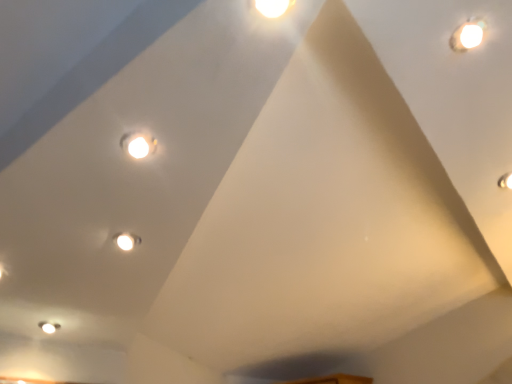
This screenshot has height=384, width=512. I want to click on matte white light at upper right, acting as the first light starting from the back, so click(x=505, y=181).

This screenshot has height=384, width=512. I want to click on white glossy droplight at upper right, so click(467, 36).

Does white glossy droplight at upper right appear on the right side of matte white light at upper center, placed as the second light when sorted from back to front?

Yes.

Is white glossy droplight at upper right directly adjacent to matte white light at upper center, which is counted as the second light, starting from the bottom?

They are not placed beside each other.

Is the depth of white glossy droplight at upper right less than that of matte white light at upper center, the 2th light when ordered from right to left?

Yes, it is in front of matte white light at upper center, the 2th light when ordered from right to left.

Can you confirm if white glossy droplight at upper right is wider than matte white light at upper center, which is the first light in left-to-right order?

Yes.

Is matte white light at upper center, the 2th light when ordered from right to left, facing away from matte white light at upper right, which is counted as the first light, starting from the bottom?

matte white light at upper center, the 2th light when ordered from right to left, is not turned away from matte white light at upper right, which is counted as the first light, starting from the bottom.

In the scene shown: Can you confirm if matte white light at upper center, placed as the second light when sorted from back to front, is positioned to the left of matte white light at upper right, placed as the second light when sorted from left to right?

Correct, you'll find matte white light at upper center, placed as the second light when sorted from back to front, to the left of matte white light at upper right, placed as the second light when sorted from left to right.

Considering the points (152, 145) and (502, 185), which point is in front, point (152, 145) or point (502, 185)?

The point (152, 145) is in front.

Is matte white light at upper center, the 2th light when ordered from right to left, wider or thinner than white glossy droplight at upper right?

In the image, matte white light at upper center, the 2th light when ordered from right to left, appears to be more narrow than white glossy droplight at upper right.

Looking at this image, choose the correct answer: Is matte white light at upper center, which is counted as the second light, starting from the bottom, inside white glossy droplight at upper right or outside it?

matte white light at upper center, which is counted as the second light, starting from the bottom, is outside white glossy droplight at upper right.

Image resolution: width=512 pixels, height=384 pixels. I want to click on the 1st light positioned below the white glossy droplight at upper right (from the image's perspective), so click(138, 144).

How far apart are matte white light at upper center, which is the first light in left-to-right order, and white glossy droplight at upper right?

They are 27.10 inches apart.

Is point (507, 179) positioned in front of point (480, 42)?

No, (507, 179) is further to viewer.

Does matte white light at upper right, the 2th light positioned from the top, have a greater width compared to white glossy droplight at upper right?

Indeed, matte white light at upper right, the 2th light positioned from the top, has a greater width compared to white glossy droplight at upper right.

Who is more distant, matte white light at upper right, acting as the first light starting from the back, or white glossy droplight at upper right?

Positioned behind is matte white light at upper right, acting as the first light starting from the back.

Does matte white light at upper right, placed as the second light when sorted from left to right, have a lesser height compared to matte white light at upper center, arranged as the 1th light when viewed from the top?

Incorrect, the height of matte white light at upper right, placed as the second light when sorted from left to right, does not fall short of that of matte white light at upper center, arranged as the 1th light when viewed from the top.

Could you tell me if matte white light at upper right, acting as the first light starting from the back, is facing matte white light at upper center, placed as the second light when sorted from back to front?

Yes, matte white light at upper right, acting as the first light starting from the back, is oriented towards matte white light at upper center, placed as the second light when sorted from back to front.

Considering the relative sizes of matte white light at upper right, the 2th light positioned from the top, and matte white light at upper center, which is the first light in left-to-right order, in the image provided, is matte white light at upper right, the 2th light positioned from the top, thinner than matte white light at upper center, which is the first light in left-to-right order,?

No.

Which is correct: matte white light at upper right, the 2th light positioned from the top, is inside matte white light at upper center, which is counted as the second light, starting from the bottom, or outside of it?

matte white light at upper right, the 2th light positioned from the top, is not enclosed by matte white light at upper center, which is counted as the second light, starting from the bottom.

From the image's perspective, is white glossy droplight at upper right over matte white light at upper right, which is counted as the 1th light, starting from the right?

Yes, from the image's perspective, white glossy droplight at upper right is above matte white light at upper right, which is counted as the 1th light, starting from the right.

In the image, is white glossy droplight at upper right on the left side or the right side of matte white light at upper right, which is counted as the first light, starting from the bottom?

From the image, it's evident that white glossy droplight at upper right is to the left of matte white light at upper right, which is counted as the first light, starting from the bottom.

Would you consider white glossy droplight at upper right to be distant from matte white light at upper right, the 2th light positioned from the top?

That's not correct — white glossy droplight at upper right is a little close to matte white light at upper right, the 2th light positioned from the top.

Locate an element on the screen. droplight above the matte white light at upper center, arranged as the 1th light when viewed from the top (from the image's perspective) is located at coordinates (467, 36).

Find the location of `light below the matte white light at upper center, arranged as the 1th light when viewed from the top (from the image's perspective)`. light below the matte white light at upper center, arranged as the 1th light when viewed from the top (from the image's perspective) is located at coordinates (505, 181).

From the image, which object appears to be nearer to matte white light at upper right, the 2th light from the front, white glossy droplight at upper right or matte white light at upper center, marked as the first light in a front-to-back arrangement?

Based on the image, white glossy droplight at upper right appears to be nearer to matte white light at upper right, the 2th light from the front.

From the image, which object appears to be farther from white glossy droplight at upper right, matte white light at upper right, acting as the first light starting from the back, or matte white light at upper center, which is counted as the second light, starting from the bottom?

matte white light at upper center, which is counted as the second light, starting from the bottom.

Estimate the real-world distances between objects in this image. Which object is further from matte white light at upper center, the 2th light when ordered from right to left, matte white light at upper right, which is counted as the 1th light, starting from the right, or white glossy droplight at upper right?

matte white light at upper right, which is counted as the 1th light, starting from the right, is positioned further to the anchor matte white light at upper center, the 2th light when ordered from right to left.

Estimate the real-world distances between objects in this image. Which object is further from matte white light at upper center, which is counted as the second light, starting from the bottom, white glossy droplight at upper right or matte white light at upper right, the 2th light positioned from the top?

matte white light at upper right, the 2th light positioned from the top, is positioned further to the anchor matte white light at upper center, which is counted as the second light, starting from the bottom.

From the picture: Looking at the image, which one is located closer to matte white light at upper right, which is counted as the 1th light, starting from the right, matte white light at upper center, which is the first light in left-to-right order, or white glossy droplight at upper right?

white glossy droplight at upper right is closer to matte white light at upper right, which is counted as the 1th light, starting from the right.

When comparing their distances from white glossy droplight at upper right, does matte white light at upper center, placed as the second light when sorted from back to front, or matte white light at upper right, the 2th light positioned from the top, seem further?

Among the two, matte white light at upper center, placed as the second light when sorted from back to front, is located further to white glossy droplight at upper right.

Locate an element on the screen. The image size is (512, 384). droplight between matte white light at upper center, placed as the second light when sorted from back to front, and matte white light at upper right, the 2th light positioned from the top is located at coordinates (467, 36).